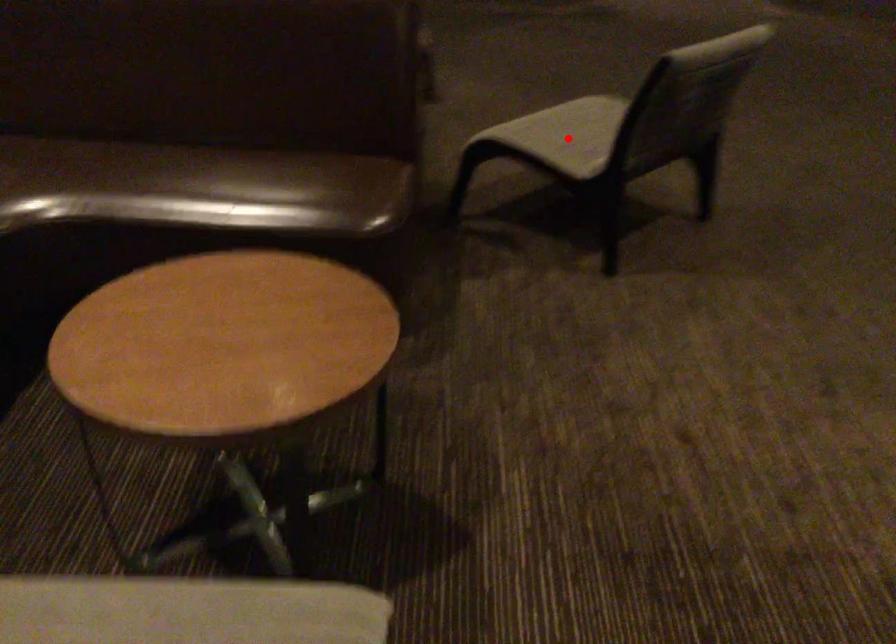
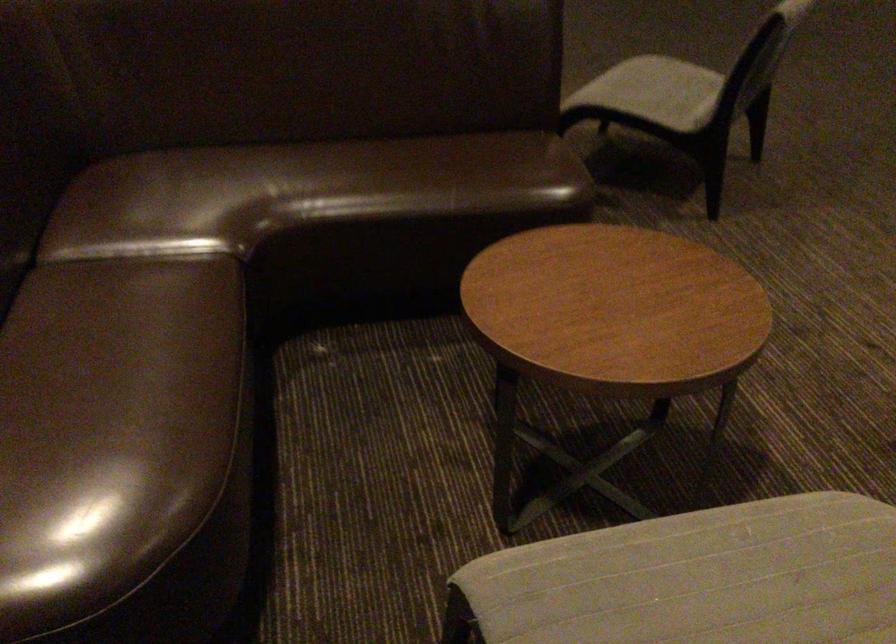
In the second image, find the point that corresponds to the highlighted location in the first image.

(655, 91)